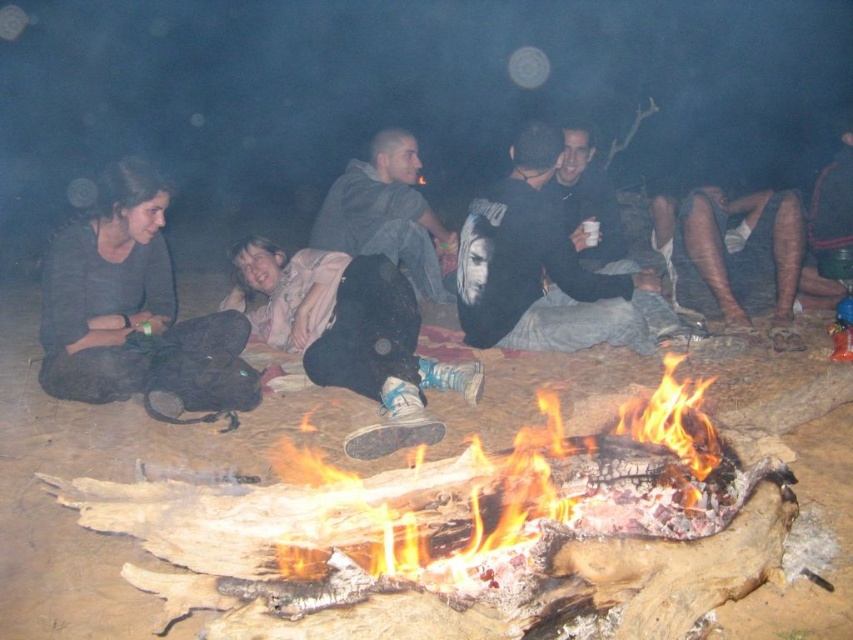
You are standing at the center of the campfire scene. Looking towards the lower right corner, can you describe the texture of the area at point (740,257)?

The point at (740,257) corresponds to brown textured skin, indicating that the texture there is similar to skin.